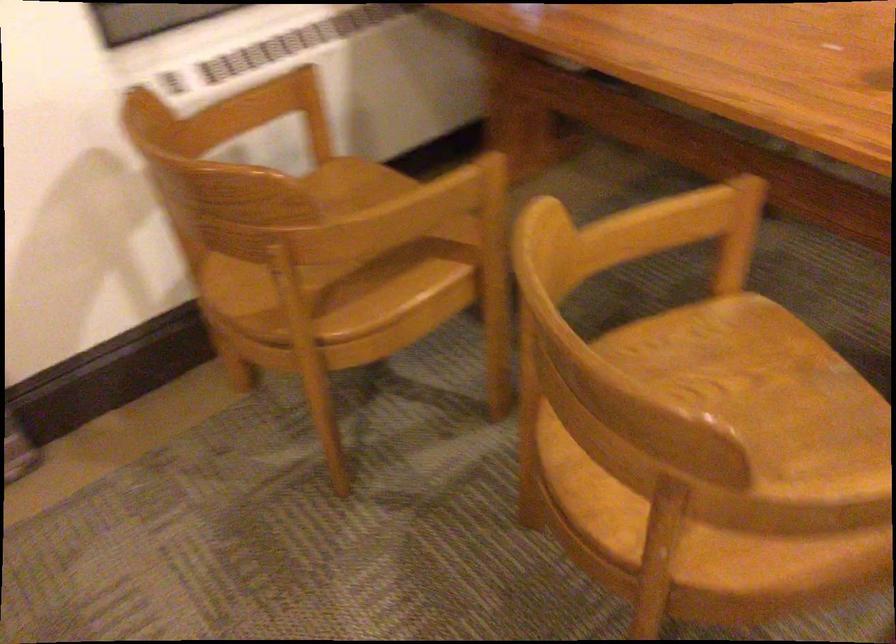
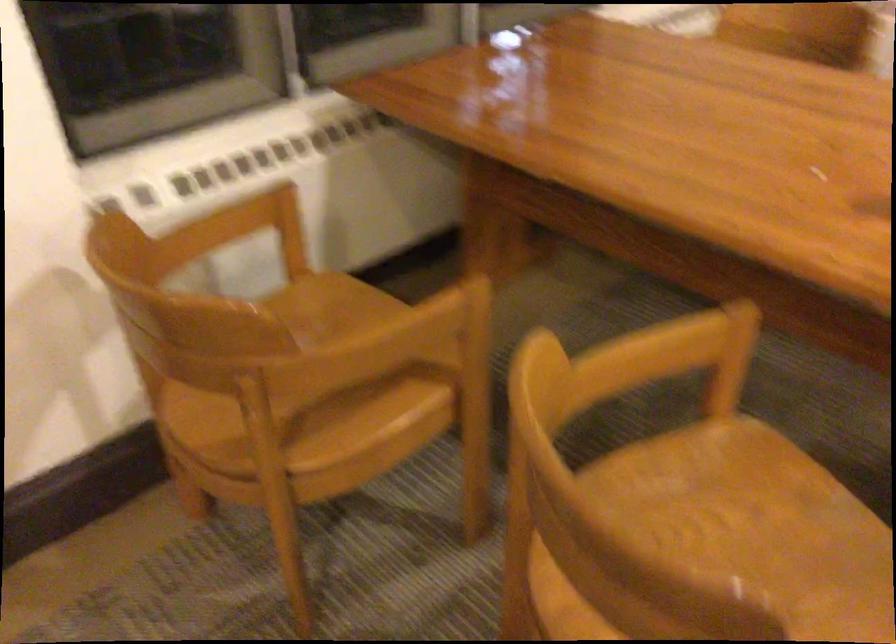
Question: The first image is from the beginning of the video and the second image is from the end. How did the camera likely rotate when shooting the video?

Choices:
 (A) Left
 (B) Right
 (C) Up
 (D) Down

Answer: (C)